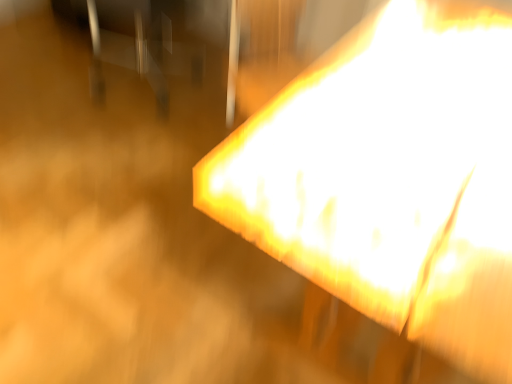
This screenshot has height=384, width=512. What do you see at coordinates (390, 178) in the screenshot? I see `matte yellow lampshade at upper right` at bounding box center [390, 178].

At what (x,y) coordinates should I click in order to perform the action: click on matte yellow lampshade at upper right. Please return your answer as a coordinate pair (x, y). Image resolution: width=512 pixels, height=384 pixels. Looking at the image, I should click on (390, 178).

What is the approximate width of matte yellow lampshade at upper right?

It is 9.45 feet.

This screenshot has width=512, height=384. Identify the location of matte yellow lampshade at upper right. (390, 178).